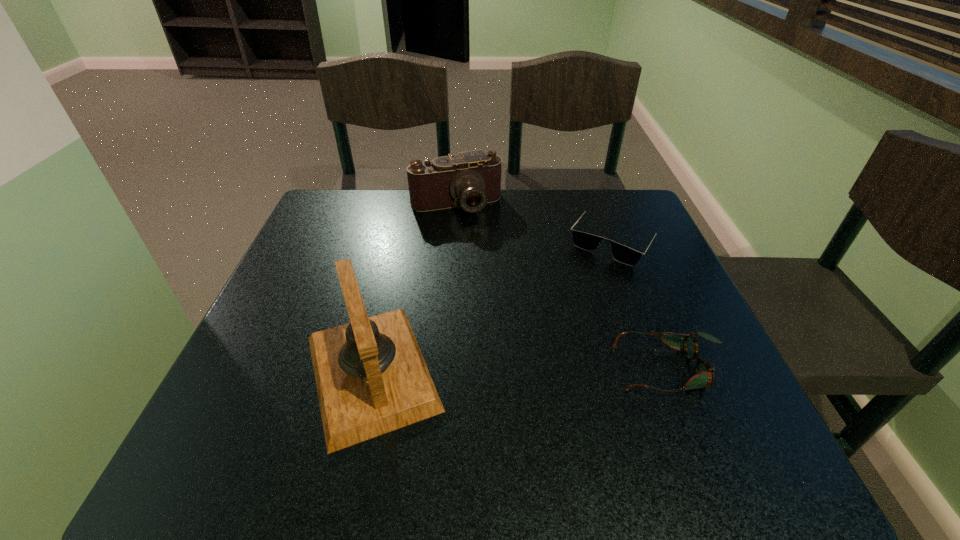
Where is `vacant area between the second tallest object and the tallest object`? This screenshot has height=540, width=960. vacant area between the second tallest object and the tallest object is located at coordinates (414, 289).

Locate an element on the screen. free spot between the sunglasses and the second tallest object is located at coordinates (536, 222).

The image size is (960, 540). Identify the location of vacant area that lies between the camera and the spectacles. (563, 287).

Where is `vacant area between the sunglasses and the tallest object`? The width and height of the screenshot is (960, 540). vacant area between the sunglasses and the tallest object is located at coordinates (493, 306).

The width and height of the screenshot is (960, 540). What are the coordinates of `free point between the camera and the sunglasses` in the screenshot? It's located at (536, 222).

Find the location of `vacant space in between the sunglasses and the third shortest object`. vacant space in between the sunglasses and the third shortest object is located at coordinates (536, 222).

Find the location of a particular element. This screenshot has height=540, width=960. free space between the spectacles and the second tallest object is located at coordinates (563, 287).

The width and height of the screenshot is (960, 540). Find the location of `unoccupied position between the bell and the camera`. unoccupied position between the bell and the camera is located at coordinates (414, 289).

At what (x,y) coordinates should I click in order to perform the action: click on free space between the sunglasses and the third shortest object. Please return your answer as a coordinate pair (x, y). The height and width of the screenshot is (540, 960). Looking at the image, I should click on (536, 222).

Find the location of a particular element. free space between the camera and the sunglasses is located at coordinates (536, 222).